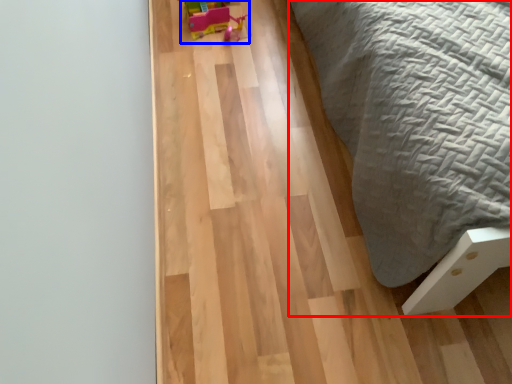
Question: Among these objects, which one is farthest to the camera, furniture (highlighted by a red box) or toy (highlighted by a blue box)?

Choices:
 (A) furniture
 (B) toy

Answer: (B)